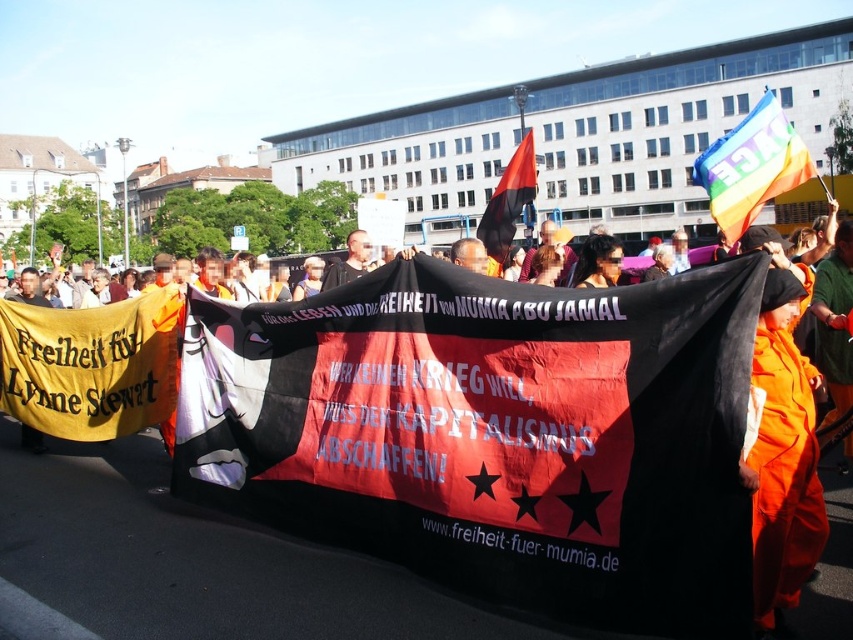
Consider the image. Can you confirm if orange jumpsuit at center is shorter than rainbow fabric flag at upper right?

Yes.

Is the position of orange jumpsuit at center more distant than that of rainbow fabric flag at upper right?

No.

Describe the element at coordinates (782, 442) in the screenshot. I see `orange jumpsuit at center` at that location.

Identify the location of orange jumpsuit at center. The height and width of the screenshot is (640, 853). (782, 442).

Which of these two, rainbow fabric flag at upper right or red fabric flag at center, stands taller?

red fabric flag at center is taller.

Which of these two, rainbow fabric flag at upper right or red fabric flag at center, stands shorter?

rainbow fabric flag at upper right

This screenshot has height=640, width=853. I want to click on rainbow fabric flag at upper right, so click(x=751, y=166).

Where is `rainbow fabric flag at upper right`? Image resolution: width=853 pixels, height=640 pixels. rainbow fabric flag at upper right is located at coordinates (751, 166).

Is orange jumpsuit at center closer to camera compared to red fabric flag at center?

Yes.

The width and height of the screenshot is (853, 640). I want to click on orange jumpsuit at center, so click(x=782, y=442).

The width and height of the screenshot is (853, 640). I want to click on orange jumpsuit at center, so click(x=782, y=442).